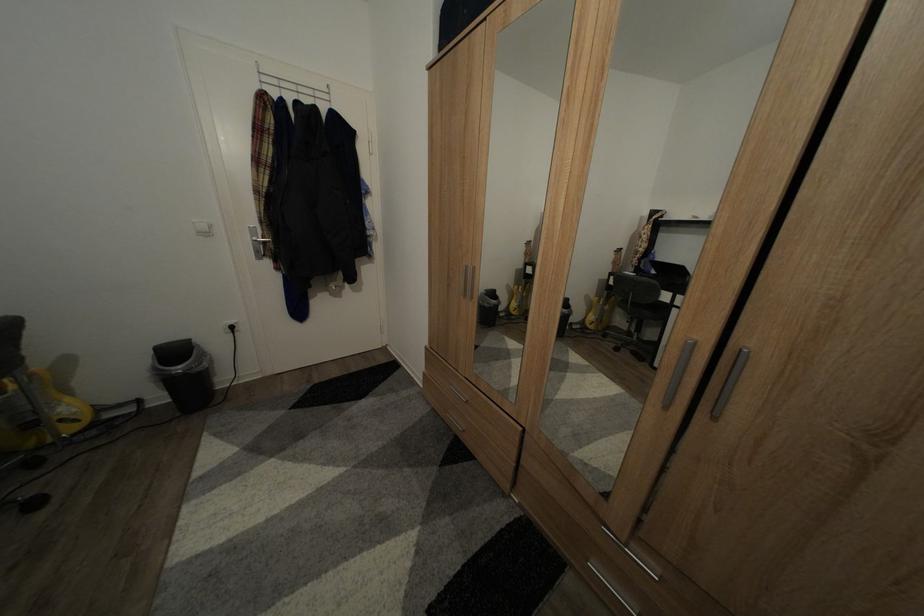
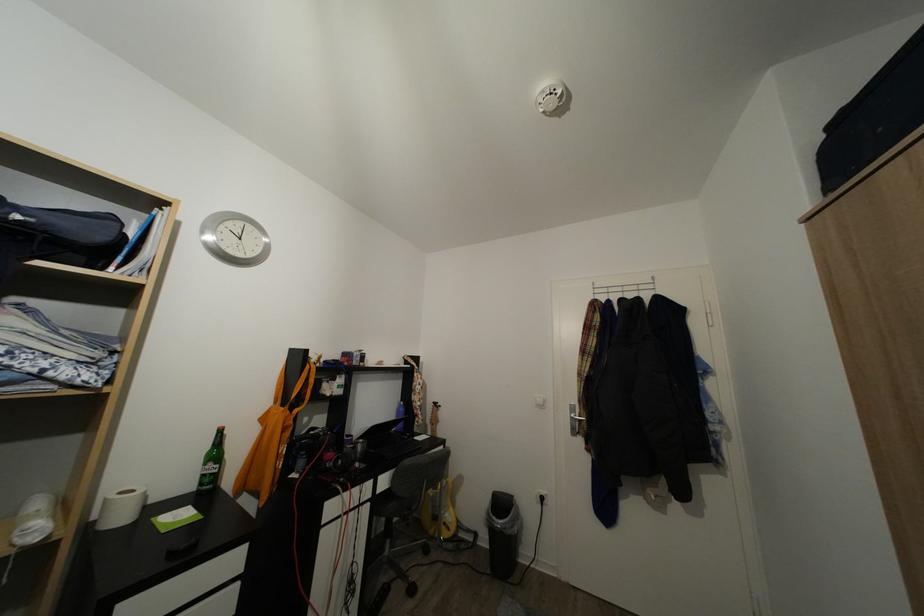
In the second image, find the point that corresponds to pixel 69 427 in the first image.

(453, 531)